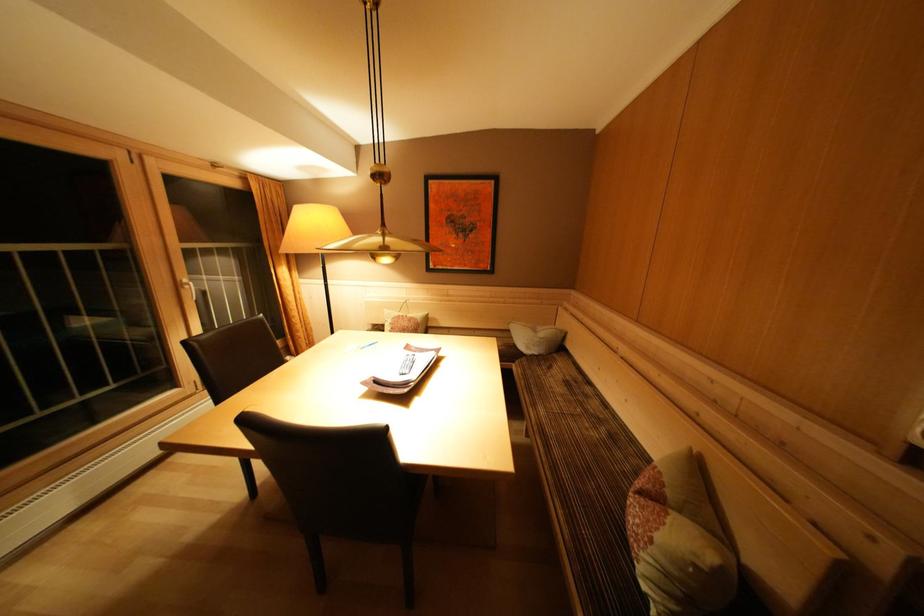
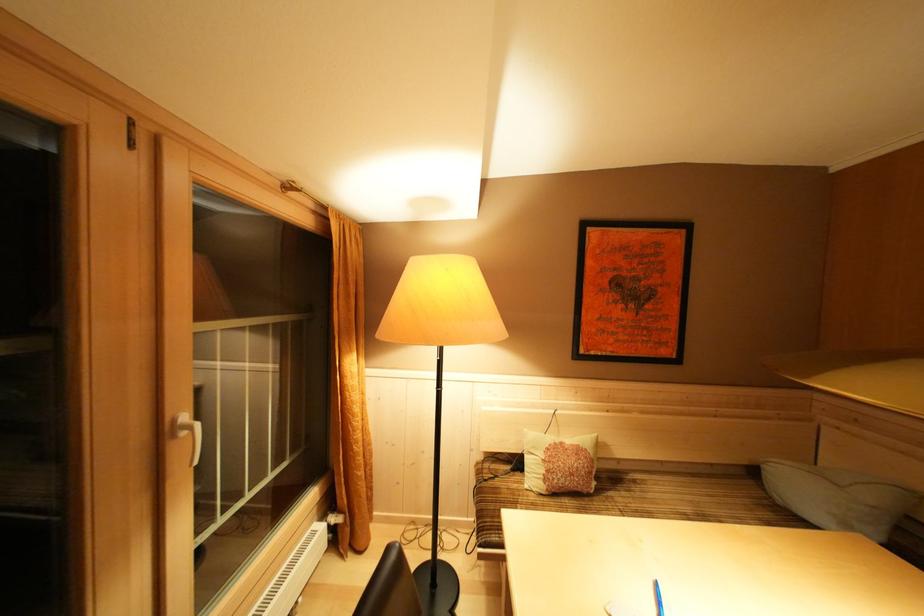
Question: I am providing you with two images of the same scene from different viewpoints. Which of the following objects are not visible in image2?

Choices:
 (A) blue pen
 (B) light blue pillow
 (C) black floor lamp
 (D) none of these

Answer: (D)